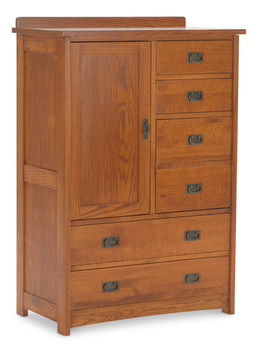
Identify the location of door. (137, 141).